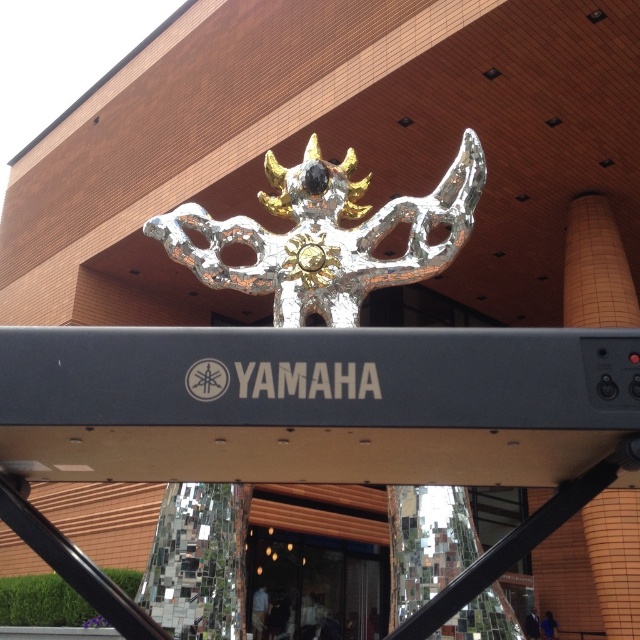
Question: Which object appears closest to the camera in this image?

Choices:
 (A) transparent glass door at lower center
 (B) shiny silver sculpture at center
 (C) orange textured pillar at upper center

Answer: (B)

Question: Is shiny silver sculpture at center wider than transparent glass door at lower center?

Choices:
 (A) yes
 (B) no

Answer: (A)

Question: Which point is farther to the camera?

Choices:
 (A) (384, 212)
 (B) (577, 316)

Answer: (B)

Question: Among these points, which one is nearest to the camera?

Choices:
 (A) (296, 225)
 (B) (275, 621)
 (C) (608, 310)

Answer: (A)

Question: Observing the image, what is the correct spatial positioning of shiny silver sculpture at center in reference to orange textured pillar at upper center?

Choices:
 (A) below
 (B) above

Answer: (B)

Question: Does shiny silver sculpture at center have a smaller size compared to transparent glass door at lower center?

Choices:
 (A) no
 (B) yes

Answer: (B)